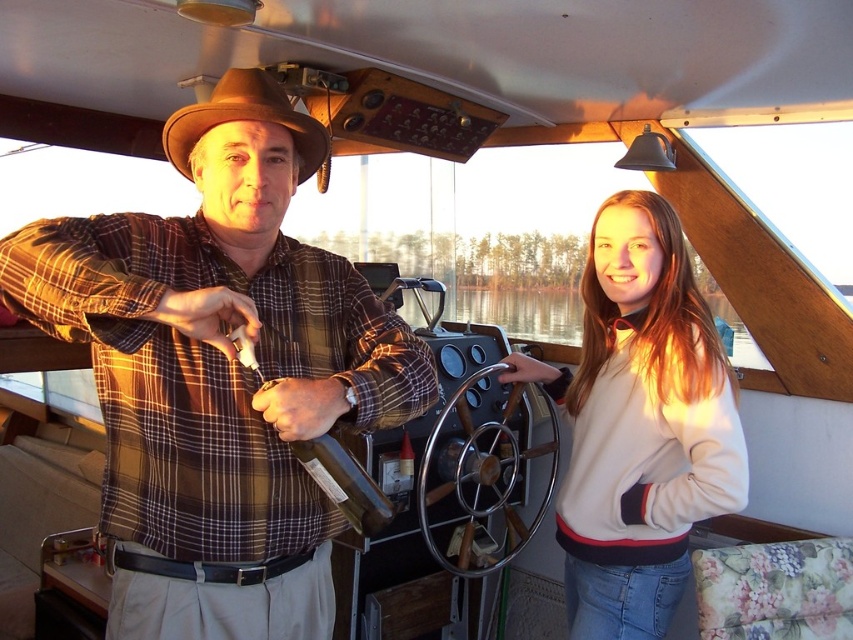
Is point (180, 225) positioned before point (608, 515)?

Yes, point (180, 225) is closer to viewer.

Which is above, brown plaid shirt at center or light beige fleece at center?

brown plaid shirt at center is above.

Is point (213, 572) positioned before point (570, 563)?

Yes.

At what (x,y) coordinates should I click in order to perform the action: click on brown plaid shirt at center. Please return your answer as a coordinate pair (x, y). Looking at the image, I should click on (219, 372).

Between brown plaid shirt at center and brown felt cowboy hat at upper center, which one is positioned higher?

brown felt cowboy hat at upper center is higher up.

Can you confirm if brown plaid shirt at center is positioned to the left of brown felt cowboy hat at upper center?

Incorrect, brown plaid shirt at center is not on the left side of brown felt cowboy hat at upper center.

In the scene shown: Who is more distant from viewer, (267, 273) or (184, 145)?

The point (267, 273) is more distant.

At what (x,y) coordinates should I click in order to perform the action: click on brown plaid shirt at center. Please return your answer as a coordinate pair (x, y). Looking at the image, I should click on (219, 372).

Does light beige fleece at center have a greater height compared to brown felt cowboy hat at upper center?

Indeed, light beige fleece at center has a greater height compared to brown felt cowboy hat at upper center.

Locate an element on the screen. light beige fleece at center is located at coordinates (639, 424).